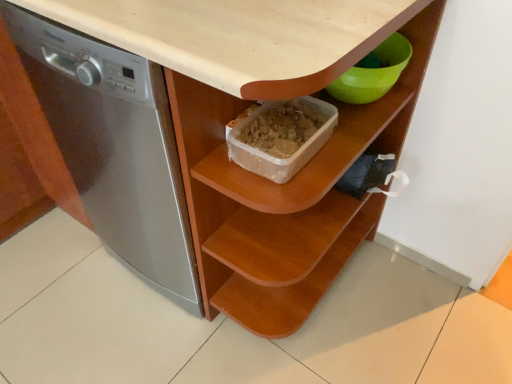
Question: Which is correct: wooden container at center is inside satin silver dishwasher at left, or outside of it?

Choices:
 (A) outside
 (B) inside

Answer: (A)

Question: Based on their positions, is wooden container at center located to the left or right of satin silver dishwasher at left?

Choices:
 (A) right
 (B) left

Answer: (A)

Question: Considering the positions of wooden container at center and satin silver dishwasher at left in the image, is wooden container at center taller or shorter than satin silver dishwasher at left?

Choices:
 (A) short
 (B) tall

Answer: (A)

Question: Based on their sizes in the image, would you say satin silver dishwasher at left is bigger or smaller than wooden container at center?

Choices:
 (A) small
 (B) big

Answer: (B)

Question: Relative to wooden container at center, is satin silver dishwasher at left in front or behind?

Choices:
 (A) behind
 (B) front

Answer: (B)

Question: Would you say satin silver dishwasher at left is inside or outside wooden container at center?

Choices:
 (A) inside
 (B) outside

Answer: (B)

Question: Based on their positions, is satin silver dishwasher at left located to the left or right of wooden container at center?

Choices:
 (A) left
 (B) right

Answer: (A)